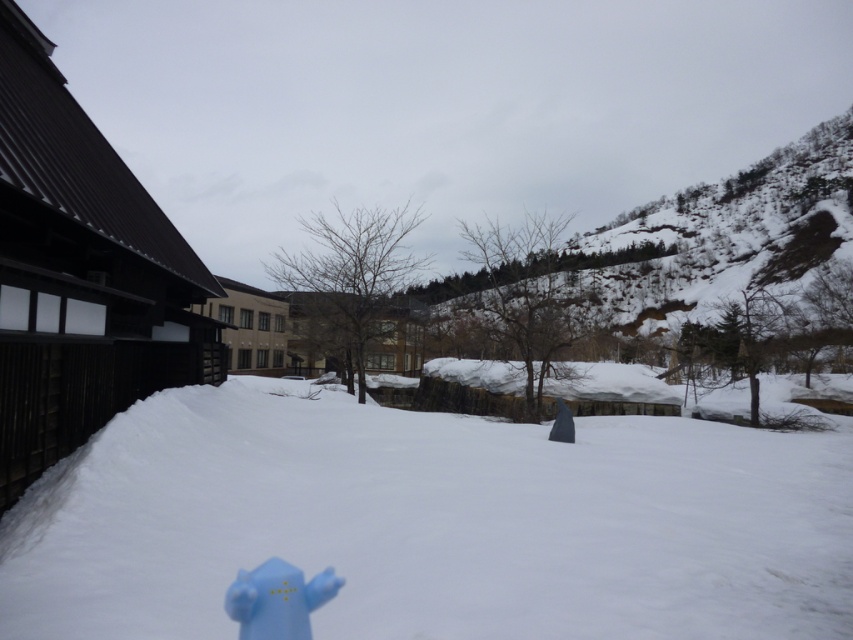
From the picture: You are a delivery robot that needs to place a small package on the ground. The package is 10 cm wide. You have to choose between placing it on the white fluffy snow at center or the blue matte fire hydrant at lower left. Which location has enough space for the package?

The white fluffy snow at center is larger in size than the blue matte fire hydrant at lower left, so the white fluffy snow at center has enough space for the 10 cm wide package.

From the picture: You are a snowplow operator trying to clear snow from the road. You notice the blue matte fire hydrant at lower left is partially buried by the white fluffy snow at center. How does the height of the snow compare to the hydrant?

The white fluffy snow at center is much taller than the blue matte fire hydrant at lower left, meaning the snow is significantly deeper than the hydrant itself.